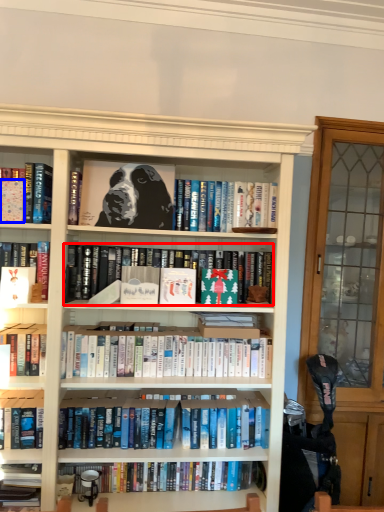
Question: Which object is closer to the camera taking this photo, book (highlighted by a red box) or paperback book (highlighted by a blue box)?

Choices:
 (A) book
 (B) paperback book

Answer: (B)